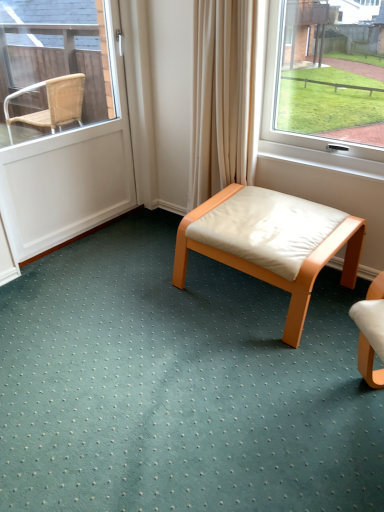
Where is `free area below light brown wood stool at center (from a real-world perspective)`? The image size is (384, 512). free area below light brown wood stool at center (from a real-world perspective) is located at coordinates (246, 291).